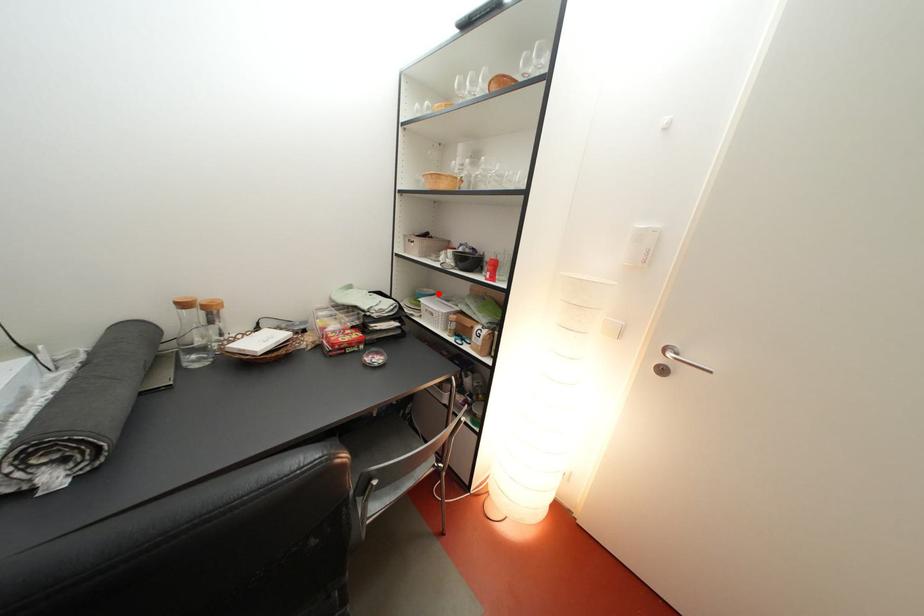
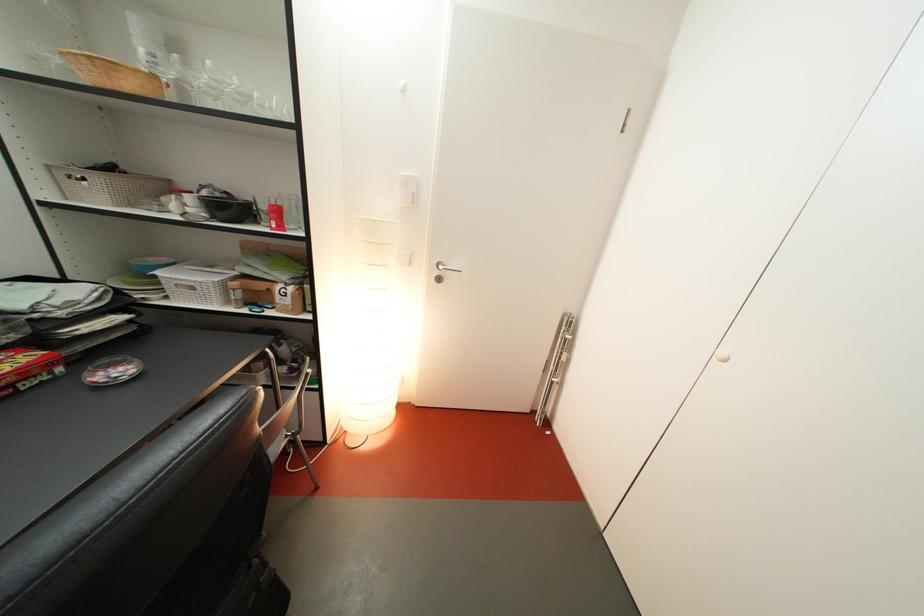
Where in the second image is the point corresponding to the highlighted location from the first image?

(161, 262)